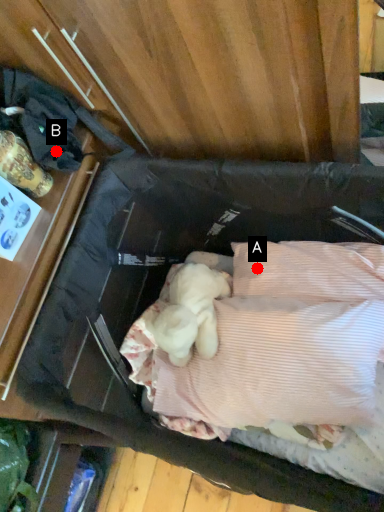
Question: Two points are circled on the image, labeled by A and B beside each circle. Which point is closer to the camera taking this photo?

Choices:
 (A) A is closer
 (B) B is closer

Answer: (B)